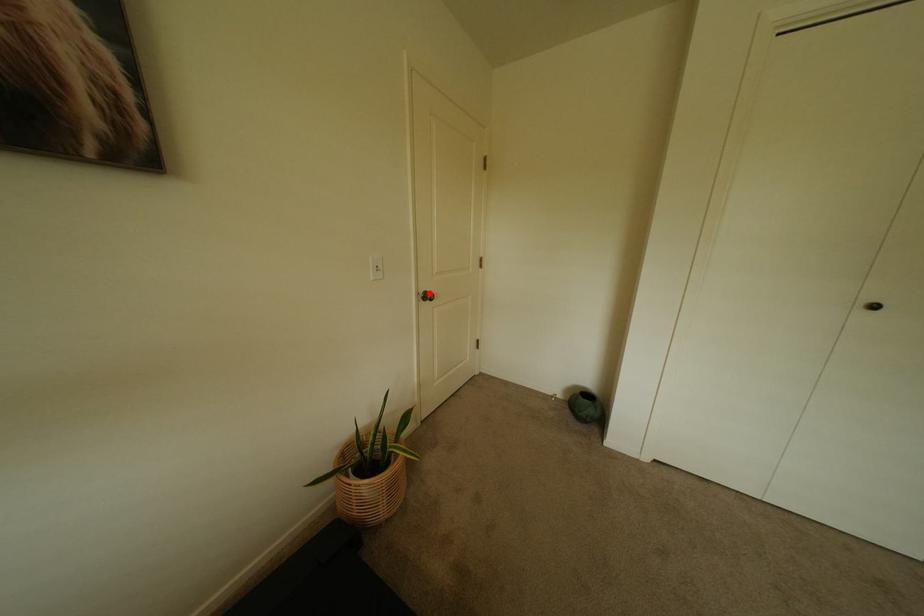
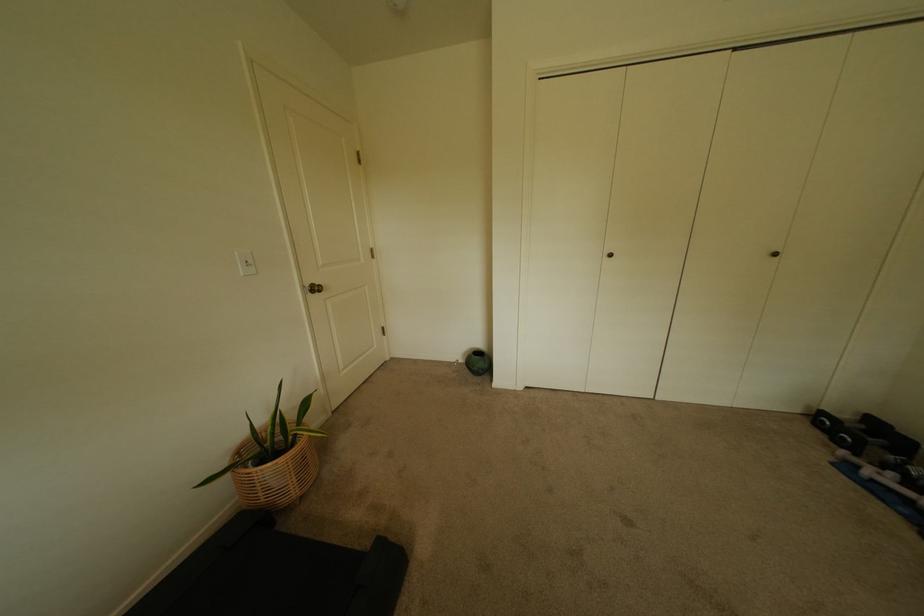
Question: I am providing you with two images of the same scene from different viewpoints. Image1 has a red point marked. In image2, the corresponding 3D location appears at what relative position? Reply with the corresponding letter.

Choices:
 (A) Closer
 (B) Farther

Answer: (A)